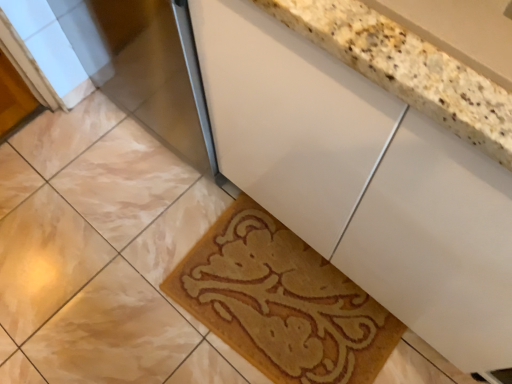
Identify the location of free space in front of marble tile at lower left. This screenshot has width=512, height=384. (60, 317).